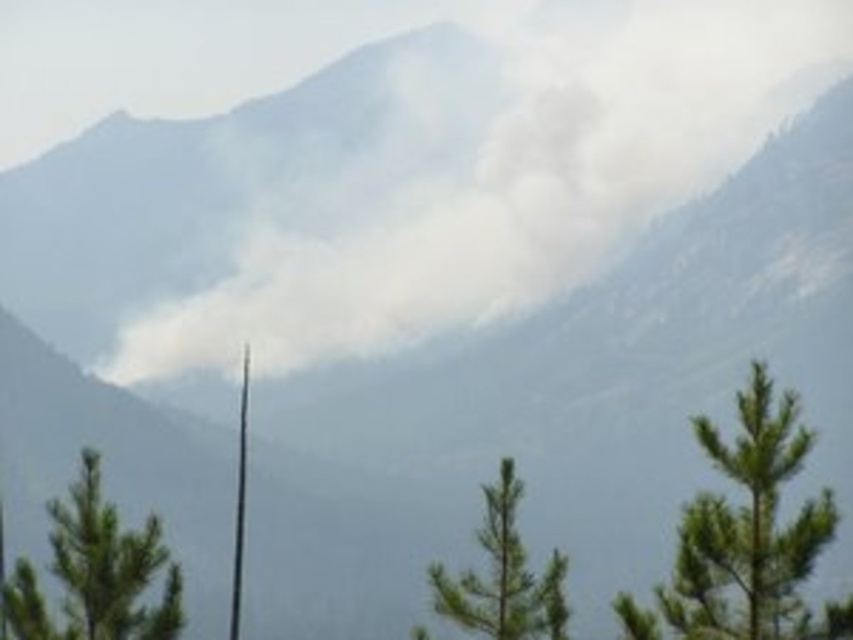
Between white smoke at center and green needle-like tree at center-right, which one appears on the right side from the viewer's perspective?

white smoke at center

Is white smoke at center below green needle-like tree at center-right?

Actually, white smoke at center is above green needle-like tree at center-right.

The image size is (853, 640). What do you see at coordinates (519, 182) in the screenshot?
I see `white smoke at center` at bounding box center [519, 182].

Image resolution: width=853 pixels, height=640 pixels. I want to click on white smoke at center, so click(x=519, y=182).

Does white smoke at center have a lesser width compared to green needle-like tree at center?

In fact, white smoke at center might be wider than green needle-like tree at center.

Locate an element on the screen. white smoke at center is located at coordinates (519, 182).

Does white smoke at center have a greater width compared to green matte tree at lower left?

Yes.

Is white smoke at center closer to camera compared to green matte tree at lower left?

No.

What do you see at coordinates (519, 182) in the screenshot? I see `white smoke at center` at bounding box center [519, 182].

Identify the location of white smoke at center. This screenshot has width=853, height=640. (519, 182).